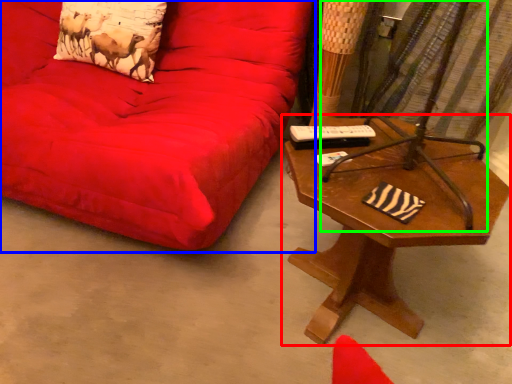
Question: Based on their relative distances, which object is nearer to table (highlighted by a red box)? Choose from studio couch (highlighted by a blue box) and swivel chair (highlighted by a green box).

Choices:
 (A) studio couch
 (B) swivel chair

Answer: (B)